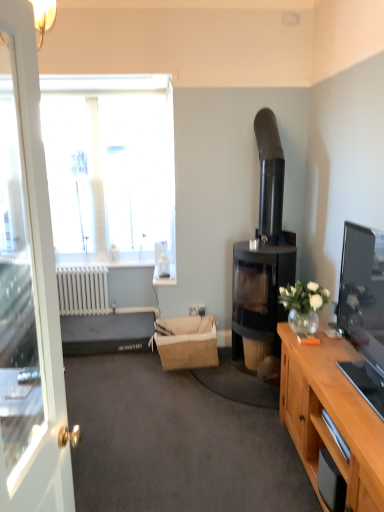
The width and height of the screenshot is (384, 512). Identify the location of vacant space that is to the left of brown woven picnic basket at center. (136, 369).